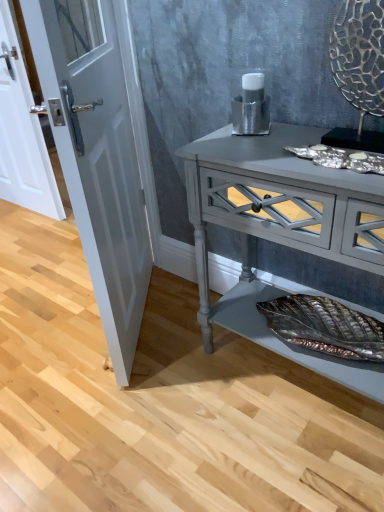
Question: Is white glossy door at left, which ranks as the 2th door in back-to-front order, in front of or behind matte gray console table at center in the image?

Choices:
 (A) front
 (B) behind

Answer: (B)

Question: From a real-world perspective, is white glossy door at left, acting as the second door starting from the left, physically located above or below matte gray console table at center?

Choices:
 (A) above
 (B) below

Answer: (A)

Question: Estimate the real-world distances between objects in this image. Which object is closer to the white glossy door at left, the first door positioned from the left?

Choices:
 (A) matte gray console table at center
 (B) white glossy door at left, acting as the second door starting from the left

Answer: (B)

Question: Based on their relative distances, which object is nearer to the matte gray console table at center?

Choices:
 (A) white glossy door at left, which is the second door in right-to-left order
 (B) white glossy door at left, arranged as the first door when viewed from the right

Answer: (B)